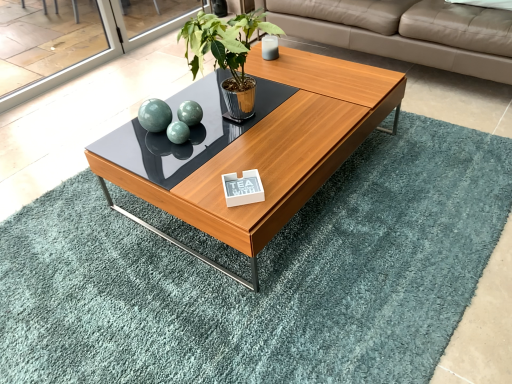
Find the location of a particular element. vacant area located to the right-hand side of wooden coffee table at center is located at coordinates (426, 180).